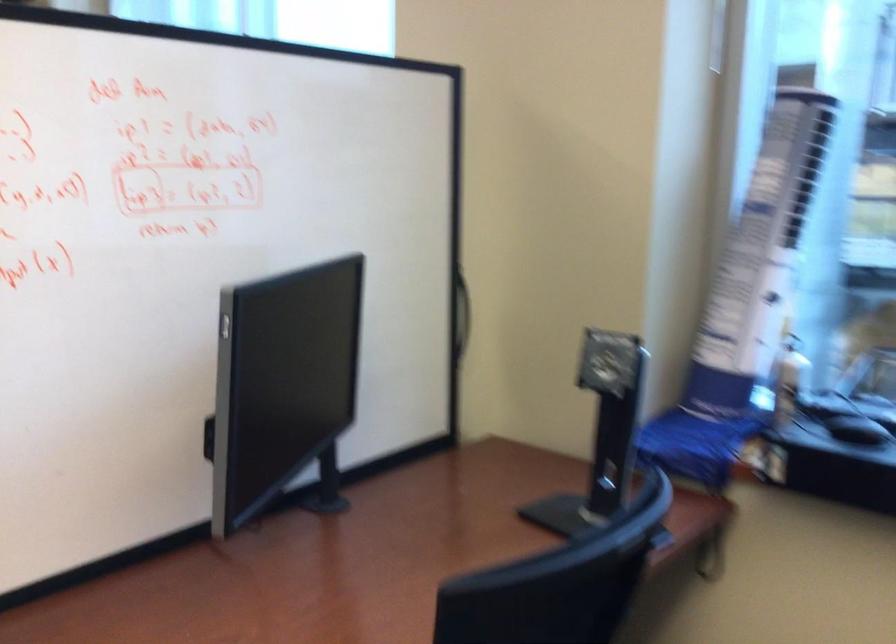
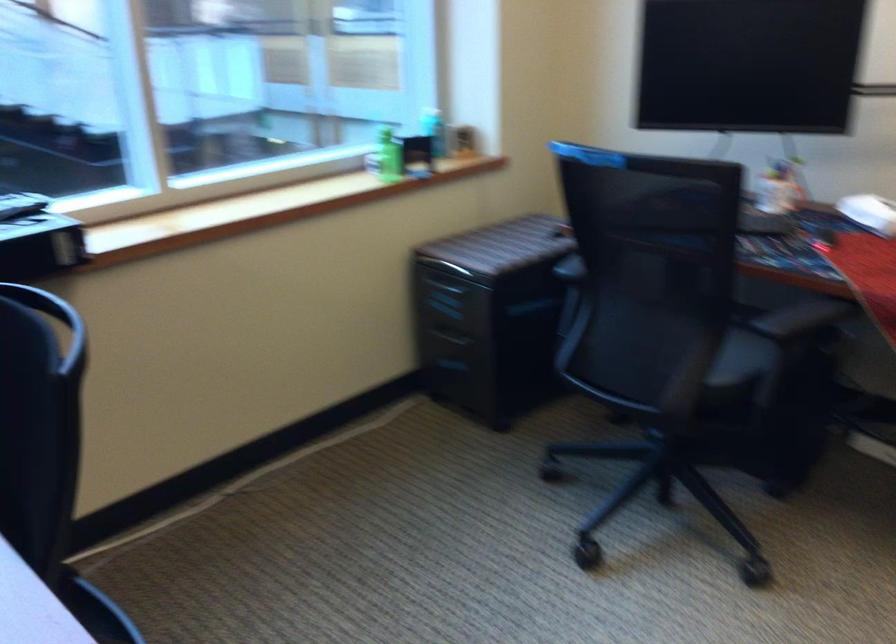
Based on the continuous images, in which direction is the camera rotating?

The camera's rotation is toward right-down.